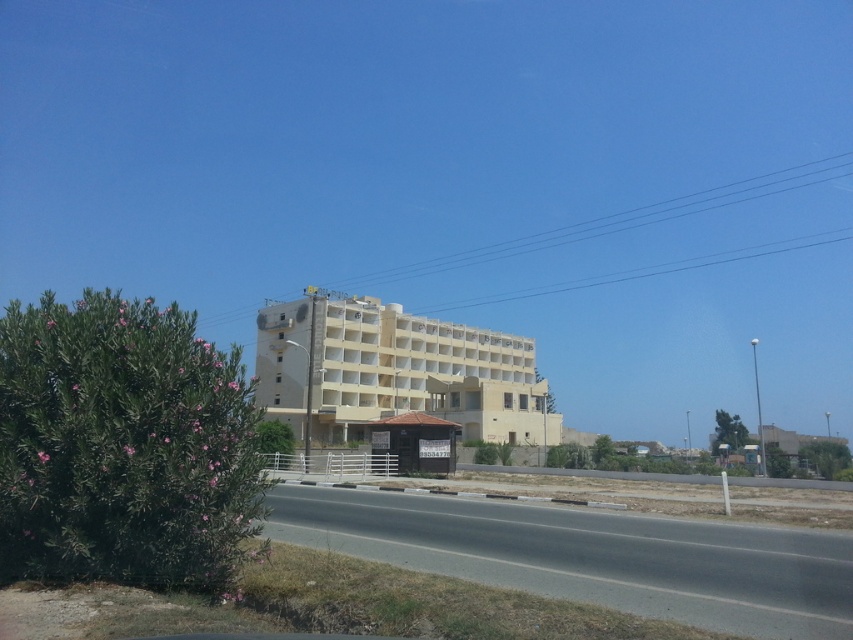
Is asphalt road at center wider than beige concrete building at center?

No, asphalt road at center is not wider than beige concrete building at center.

Can you confirm if asphalt road at center is smaller than beige concrete building at center?

Yes, asphalt road at center is smaller than beige concrete building at center.

Find the location of `asphalt road at center`. asphalt road at center is located at coordinates [593, 556].

Identify the location of asphalt road at center. The height and width of the screenshot is (640, 853). (593, 556).